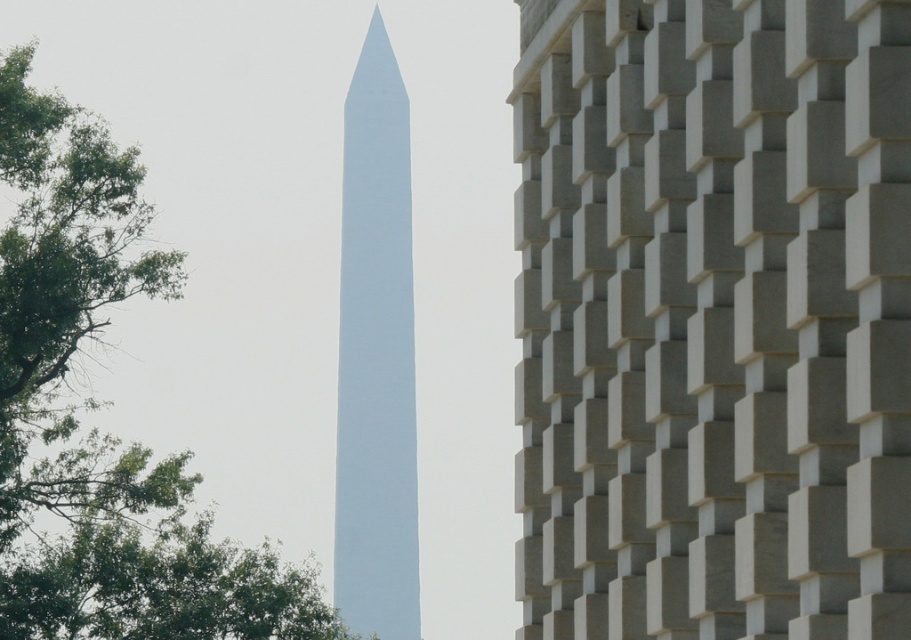
Is green leafy tree at left to the left of white smooth tower at center from the viewer's perspective?

Correct, you'll find green leafy tree at left to the left of white smooth tower at center.

Identify the location of green leafy tree at left. Image resolution: width=911 pixels, height=640 pixels. (96, 428).

At what (x,y) coordinates should I click in order to perform the action: click on green leafy tree at left. Please return your answer as a coordinate pair (x, y). This screenshot has width=911, height=640. Looking at the image, I should click on (96, 428).

Does gray concrete blocks at center have a smaller size compared to green leafy tree at left?

Correct, gray concrete blocks at center occupies less space than green leafy tree at left.

Is gray concrete blocks at center to the right of green leafy tree at left from the viewer's perspective?

Indeed, gray concrete blocks at center is positioned on the right side of green leafy tree at left.

Which is behind, point (711, 106) or point (93, 442)?

The point (93, 442) is behind.

You are a GUI agent. You are given a task and a screenshot of the screen. Output one action in this format:
    pyautogui.click(x=<x>, y=<y>)
    Task: Click on the gray concrete blocks at center
    The height and width of the screenshot is (640, 911).
    Given the screenshot: What is the action you would take?
    pyautogui.click(x=713, y=317)

This screenshot has width=911, height=640. What do you see at coordinates (713, 317) in the screenshot?
I see `gray concrete blocks at center` at bounding box center [713, 317].

Is gray concrete blocks at center wider than white smooth tower at center?

No.

Identify the location of gray concrete blocks at center. This screenshot has width=911, height=640. (713, 317).